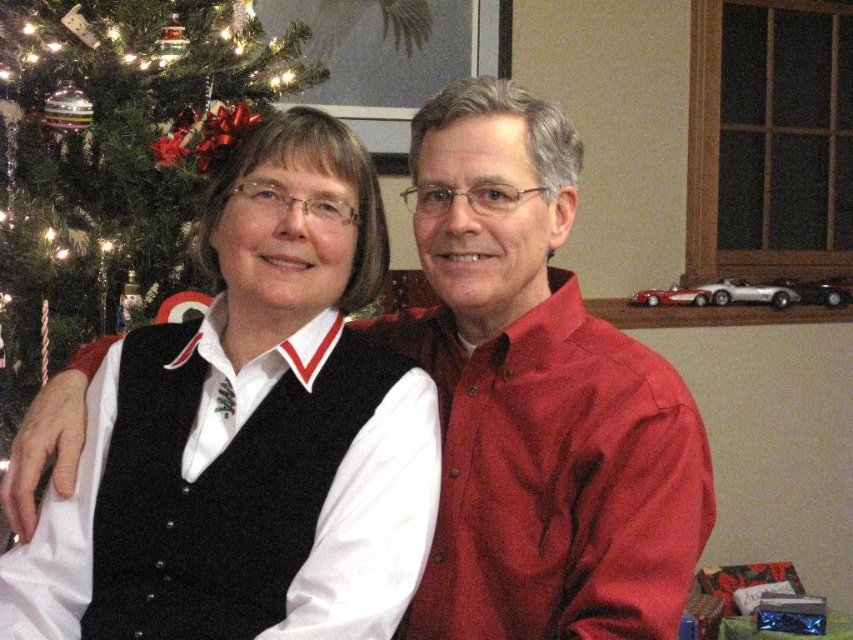
Where is `matte red shirt at center`? matte red shirt at center is located at coordinates coord(538,400).

Does matte red shirt at center have a greater width compared to green matte christmas tree at left?

Incorrect, matte red shirt at center's width does not surpass green matte christmas tree at left's.

Is point (444, 200) less distant than point (62, 176)?

Yes, it is.

At what (x,y) coordinates should I click in order to perform the action: click on matte red shirt at center. Please return your answer as a coordinate pair (x, y). The width and height of the screenshot is (853, 640). Looking at the image, I should click on click(x=538, y=400).

Who is taller, black wool vest at left or green matte christmas tree at left?

With more height is green matte christmas tree at left.

In the scene shown: Does black wool vest at left appear under green matte christmas tree at left?

Correct, black wool vest at left is located below green matte christmas tree at left.

Is point (128, 400) positioned before point (155, 54)?

That is True.

You are a GUI agent. You are given a task and a screenshot of the screen. Output one action in this format:
    pyautogui.click(x=<x>, y=<y>)
    Task: Click on the black wool vest at left
    This screenshot has height=640, width=853.
    Given the screenshot: What is the action you would take?
    pyautogui.click(x=248, y=433)

Is black wool vest at left below matte red shirt at center?

Incorrect, black wool vest at left is not positioned below matte red shirt at center.

Does point (354, 422) come behind point (564, 116)?

No, it is not.

Consider the image. Who is more distant from viewer, (x=206, y=564) or (x=566, y=176)?

The point (x=566, y=176) is more distant.

The width and height of the screenshot is (853, 640). Identify the location of black wool vest at left. (248, 433).